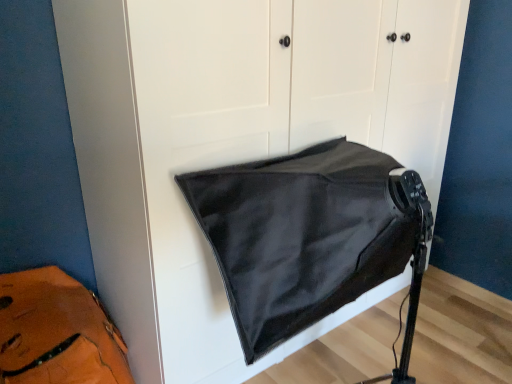
What is the approximate width of black matte/satin sleeping bag at center?

black matte/satin sleeping bag at center is 79.90 centimeters in width.

Find the location of a particular element. This screenshot has height=384, width=512. black matte/satin sleeping bag at center is located at coordinates (307, 234).

The image size is (512, 384). Describe the element at coordinates (307, 234) in the screenshot. I see `black matte/satin sleeping bag at center` at that location.

Describe the element at coordinates (57, 332) in the screenshot. I see `leather at left` at that location.

Measure the distance between leather at left and camera.

leather at left and camera are 1.15 meters apart from each other.

The image size is (512, 384). Find the location of `leather at left`. leather at left is located at coordinates (57, 332).

In order to click on black matte/satin sleeping bag at center in this screenshot , I will do click(307, 234).

Is black matte/satin sleeping bag at center at the left side of leather at left?

No, black matte/satin sleeping bag at center is not to the left of leather at left.

Does black matte/satin sleeping bag at center lie behind leather at left?

No, black matte/satin sleeping bag at center is closer to the viewer.

Between point (250, 323) and point (11, 379), which one is positioned in front?

The point (250, 323) is closer to the camera.

From the image's perspective, is black matte/satin sleeping bag at center on top of leather at left?

Yes, from the image's perspective, black matte/satin sleeping bag at center is over leather at left.

From a real-world perspective, who is located lower, black matte/satin sleeping bag at center or leather at left?

leather at left is physically lower.

Looking at their sizes, would you say black matte/satin sleeping bag at center is wider or thinner than leather at left?

black matte/satin sleeping bag at center is wider than leather at left.

Is black matte/satin sleeping bag at center taller than leather at left?

Indeed, black matte/satin sleeping bag at center has a greater height compared to leather at left.

Does black matte/satin sleeping bag at center have a smaller size compared to leather at left?

Actually, black matte/satin sleeping bag at center might be larger than leather at left.

Can leather at left be found inside black matte/satin sleeping bag at center?

No, leather at left is not a part of black matte/satin sleeping bag at center.

Would you say black matte/satin sleeping bag at center is a long distance from leather at left?

That's not correct — black matte/satin sleeping bag at center is a little close to leather at left.

Is black matte/satin sleeping bag at center facing away from leather at left?

black matte/satin sleeping bag at center does not have its back to leather at left.

How different are the orientations of black matte/satin sleeping bag at center and leather at left in degrees?

The facing directions of black matte/satin sleeping bag at center and leather at left are 3.84 degrees apart.

Image resolution: width=512 pixels, height=384 pixels. I want to click on sleeping bag located on the right of leather at left, so click(x=307, y=234).

Between leather at left and black matte/satin sleeping bag at center, which one appears on the left side from the viewer's perspective?

leather at left is more to the left.

Considering their positions, is leather at left located in front of or behind black matte/satin sleeping bag at center?

In the image, leather at left appears behind black matte/satin sleeping bag at center.

Considering the points (62, 294) and (311, 245), which point is behind, point (62, 294) or point (311, 245)?

The point (62, 294) is farther from the camera.

From the image's perspective, is leather at left above black matte/satin sleeping bag at center?

No, from the image's perspective, leather at left is not on top of black matte/satin sleeping bag at center.

From a real-world perspective, is leather at left physically above black matte/satin sleeping bag at center?

No, from a real-world perspective, leather at left is not over black matte/satin sleeping bag at center

Considering the sizes of objects leather at left and black matte/satin sleeping bag at center in the image provided, who is wider, leather at left or black matte/satin sleeping bag at center?

black matte/satin sleeping bag at center.

Considering the sizes of leather at left and black matte/satin sleeping bag at center in the image, is leather at left taller or shorter than black matte/satin sleeping bag at center?

In the image, leather at left appears to be shorter than black matte/satin sleeping bag at center.

Who is bigger, leather at left or black matte/satin sleeping bag at center?

With larger size is black matte/satin sleeping bag at center.

Is leather at left inside the boundaries of black matte/satin sleeping bag at center, or outside?

leather at left cannot be found inside black matte/satin sleeping bag at center.

Would you consider leather at left to be distant from black matte/satin sleeping bag at center?

No.

Is leather at left aimed at black matte/satin sleeping bag at center?

No, leather at left does not turn towards black matte/satin sleeping bag at center.

Looking at this image, how different are the orientations of leather at left and black matte/satin sleeping bag at center in degrees?

3.84 degrees.

Where is `messenger bag that is below the black matte/satin sleeping bag at center (from the image's perspective)`? messenger bag that is below the black matte/satin sleeping bag at center (from the image's perspective) is located at coordinates (57, 332).

In order to click on sleeping bag that appears in front of the leather at left in this screenshot , I will do `click(307, 234)`.

Find the location of a particular element. The width and height of the screenshot is (512, 384). messenger bag beneath the black matte/satin sleeping bag at center (from a real-world perspective) is located at coordinates (57, 332).